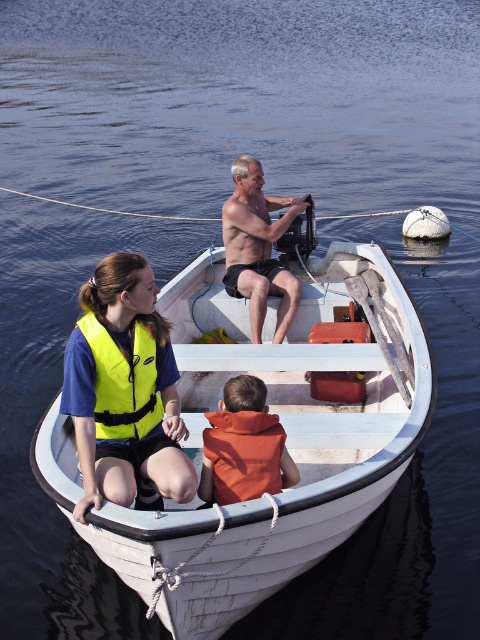
Question: Which point appears closest to the camera in this image?

Choices:
 (A) (144, 472)
 (B) (255, 285)

Answer: (A)

Question: Estimate the real-world distances between objects in this image. Which object is closer to the orange life vest at center?

Choices:
 (A) neon yellow life vest at left
 (B) yellow life vest at left
 (C) white wood boat at center

Answer: (B)

Question: Is shiny skin at center to the left of orange life vest at center from the viewer's perspective?

Choices:
 (A) yes
 (B) no

Answer: (A)

Question: Does yellow life vest at left have a lesser width compared to neon yellow life vest at left?

Choices:
 (A) yes
 (B) no

Answer: (B)

Question: Does white wood boat at center have a larger size compared to shiny skin at center?

Choices:
 (A) yes
 (B) no

Answer: (A)

Question: Which point is farther to the camera?

Choices:
 (A) (208, 486)
 (B) (251, 284)
 (C) (340, 460)
 (D) (152, 461)

Answer: (B)